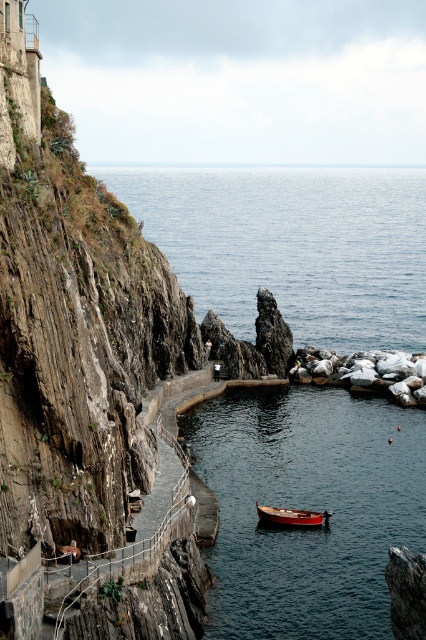
Question: Which point is farther from the camera taking this photo?

Choices:
 (A) (267, 525)
 (B) (403, 364)
 (C) (319, 406)

Answer: (B)

Question: Which of the following is the closest to the observer?

Choices:
 (A) (422, 385)
 (B) (302, 513)
 (C) (198, 202)

Answer: (B)

Question: Is smooth dark water at center below wooden boat at center?

Choices:
 (A) yes
 (B) no

Answer: (B)

Question: Is blue water at center smaller than wooden boat at center?

Choices:
 (A) yes
 (B) no

Answer: (B)

Question: Is blue water at center bigger than gray rock at lower right?

Choices:
 (A) no
 (B) yes

Answer: (B)

Question: Which point is farther to the camera?

Choices:
 (A) smooth dark water at center
 (B) wooden boat at center
 (C) gray rock at lower right
 (D) blue water at center

Answer: (D)